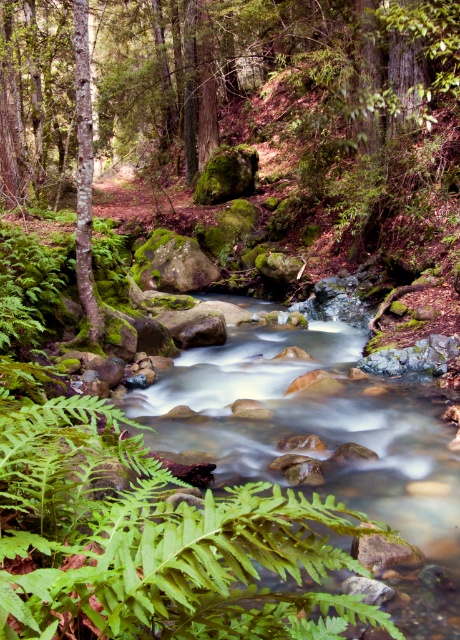
You are a hiker navigating through this forest. You see the green leafy fern at lower left and the green mossy tree at left. Which object is closer to the ground?

The green leafy fern at lower left is positioned under the green mossy tree at left, so it is closer to the ground.

You are a hiker who wants to take a photo of the green mossy tree at center and the green leafy fern at lower left. Which object should you focus on first if you want to capture both in the same frame without moving your camera?

The green mossy tree at center is much taller than the green leafy fern at lower left, so you should focus on the green mossy tree at center first to ensure it fits in the frame.

You are a hiker trying to navigate through the forest. You see the green mossy tree at center and the green leafy fern at lower left. Which object is bigger in size?

The green mossy tree at center is larger in size than the green leafy fern at lower left.